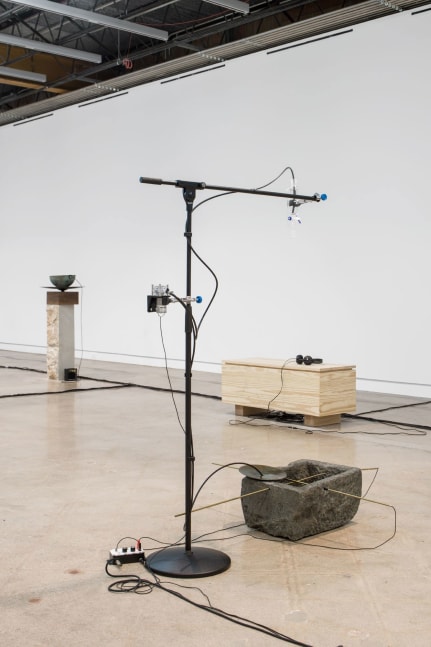
Locate an element on the screen. sculptures is located at coordinates (322, 503), (56, 281).